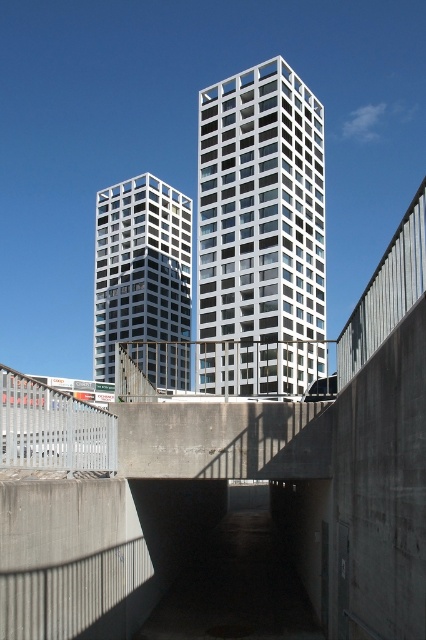
You are a drone operator trying to capture a photo of the white glass building at center and the matte glass building at left. From which building should you fly the drone to get a better view of both structures simultaneously?

The white glass building at center is positioned over the matte glass building at left, so flying the drone above the white glass building at center will allow you to see both buildings clearly.

You are a city planner reviewing a blueprint of this area. The concrete bridge at center and the matte glass building at left are both in your plan. If you need to replace the smaller structure with a new design, which one should you modify?

The matte glass building at left should be modified because the concrete bridge at center is larger in size than the matte glass building at left, making the building the smaller structure.

You are a photographer standing on the bridge and want to capture both the matte glass building at left and the concrete at center in your shot. Can you see both objects simultaneously through your camera lens?

The concrete at center is behind the matte glass building at left, so you can see both objects simultaneously through your camera lens as they are positioned in different planes.